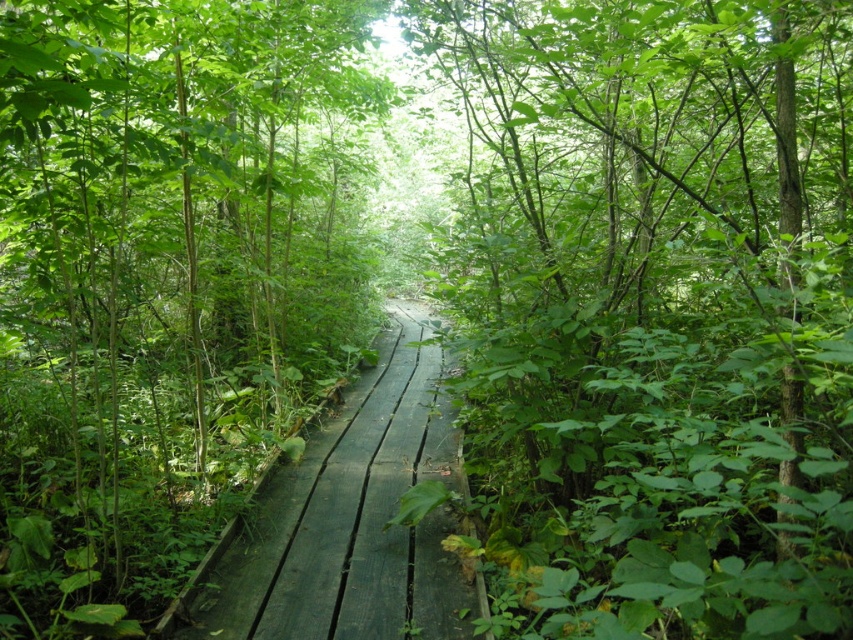
Can you confirm if green matte wood at center is positioned to the right of dark green wooden path at center?

Incorrect, green matte wood at center is not on the right side of dark green wooden path at center.

Which is in front, point (117, 13) or point (219, 595)?

Positioned in front is point (117, 13).

I want to click on green matte wood at center, so pos(165,278).

Can you confirm if green leafy tree at center is positioned to the left of green matte wood at center?

No, green leafy tree at center is not to the left of green matte wood at center.

The height and width of the screenshot is (640, 853). What do you see at coordinates (654, 310) in the screenshot?
I see `green leafy tree at center` at bounding box center [654, 310].

Between point (514, 362) and point (70, 529), which one is positioned behind?

The point (70, 529) is more distant.

The image size is (853, 640). Find the location of `green leafy tree at center`. green leafy tree at center is located at coordinates (654, 310).

Does green leafy tree at center have a smaller size compared to dark green wooden path at center?

Incorrect, green leafy tree at center is not smaller in size than dark green wooden path at center.

Can you confirm if green leafy tree at center is positioned above dark green wooden path at center?

Yes, green leafy tree at center is above dark green wooden path at center.

Between point (766, 470) and point (361, 552), which one is positioned behind?

The point (361, 552) is behind.

Locate an element on the screen. green leafy tree at center is located at coordinates (654, 310).